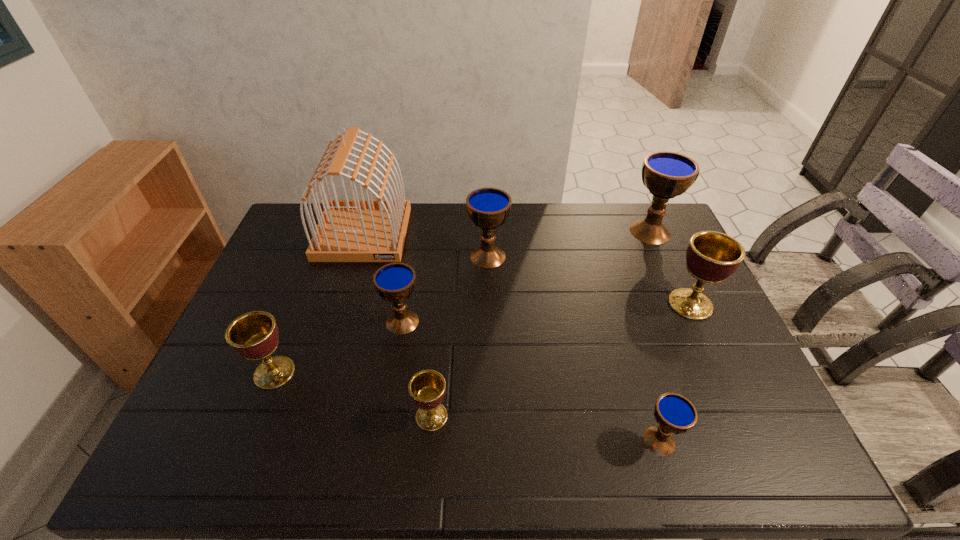
The image size is (960, 540). I want to click on vacant space located on the left of the second nearest blue chalice, so click(300, 322).

Locate an element on the screen. This screenshot has height=540, width=960. blank space located on the right of the second smallest golden chalice is located at coordinates (346, 373).

Locate an element on the screen. free space located on the right of the fifth chalice from left to right is located at coordinates (752, 441).

Locate an element on the screen. The image size is (960, 540). vacant space situated 0.400m on the back of the smallest golden chalice is located at coordinates coord(443,286).

Identify the location of birdcage that is at the far edge. This screenshot has width=960, height=540. (356, 230).

Image resolution: width=960 pixels, height=540 pixels. Identify the location of object positioned at the near edge. (674, 413).

Locate an element on the screen. birdcage at the left edge is located at coordinates (356, 230).

Where is `chalice located in the left edge section of the desktop`? The height and width of the screenshot is (540, 960). chalice located in the left edge section of the desktop is located at coordinates (254, 335).

Locate an element on the screen. The height and width of the screenshot is (540, 960). object situated at the far left corner is located at coordinates (356, 230).

Find the location of `object located in the far right corner section of the desktop`. object located in the far right corner section of the desktop is located at coordinates (666, 175).